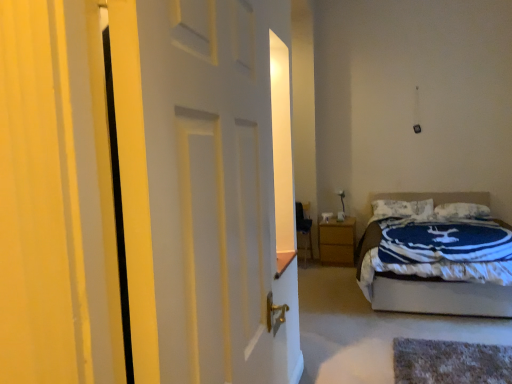
This screenshot has height=384, width=512. What are the coordinates of `white matte door at center` in the screenshot? It's located at (206, 189).

Would you consider white soft pillow at upper center, arranged as the 1th pillow when viewed from the right, to be distant from wooden nightstand at lower right?

Yes, white soft pillow at upper center, arranged as the 1th pillow when viewed from the right, and wooden nightstand at lower right are quite far apart.

Does white soft pillow at upper center, arranged as the 1th pillow when viewed from the right, come behind wooden nightstand at lower right?

No, it is not.

Is point (449, 205) closer or farther from the camera than point (334, 247)?

Point (449, 205) is positioned farther from the camera compared to point (334, 247).

Considering the sizes of objects white soft pillow at upper center, the second pillow in the left-to-right sequence, and wooden nightstand at lower right in the image provided, who is wider, white soft pillow at upper center, the second pillow in the left-to-right sequence, or wooden nightstand at lower right?

wooden nightstand at lower right is wider.

Which point is more forward, (390, 216) or (416, 303)?

Point (416, 303)

Is white textured pillow at upper center, which is counted as the first pillow, starting from the left, to the left of blue and white quilted bed at right from the viewer's perspective?

Yes, white textured pillow at upper center, which is counted as the first pillow, starting from the left, is to the left of blue and white quilted bed at right.

How different are the orientations of white textured pillow at upper center, which is counted as the first pillow, starting from the left, and blue and white quilted bed at right in degrees?

white textured pillow at upper center, which is counted as the first pillow, starting from the left, and blue and white quilted bed at right are facing 8.79e-05 degrees away from each other.

Is white textured pillow at upper center, which is counted as the first pillow, starting from the left, wider or thinner than blue and white quilted bed at right?

white textured pillow at upper center, which is counted as the first pillow, starting from the left, is thinner than blue and white quilted bed at right.

Does point (146, 142) come behind point (440, 210)?

No.

Is white matte door at center in front of or behind white soft pillow at upper center, arranged as the 1th pillow when viewed from the right, in the image?

Clearly, white matte door at center is in front of white soft pillow at upper center, arranged as the 1th pillow when viewed from the right.

Considering the relative sizes of white matte door at center and white soft pillow at upper center, arranged as the 1th pillow when viewed from the right, in the image provided, is white matte door at center thinner than white soft pillow at upper center, arranged as the 1th pillow when viewed from the right,?

Indeed, white matte door at center has a lesser width compared to white soft pillow at upper center, arranged as the 1th pillow when viewed from the right.

Based on their sizes in the image, would you say white matte door at center is bigger or smaller than white soft pillow at upper center, the second pillow in the left-to-right sequence?

Considering their sizes, white matte door at center takes up more space than white soft pillow at upper center, the second pillow in the left-to-right sequence.

Considering the positions of objects blue and white quilted bed at right and white matte door at center in the image provided, who is in front, blue and white quilted bed at right or white matte door at center?

white matte door at center is more forward.

Considering the positions of objects blue and white quilted bed at right and white matte door at center in the image provided, who is more to the right, blue and white quilted bed at right or white matte door at center?

blue and white quilted bed at right.

Is blue and white quilted bed at right turned away from white matte door at center?

That's not correct — blue and white quilted bed at right is not looking away from white matte door at center.

Is white matte door at center in contact with white textured pillow at upper center, arranged as the second pillow when viewed from the right?

No, white matte door at center is not with white textured pillow at upper center, arranged as the second pillow when viewed from the right.

From a real-world perspective, between white matte door at center and white textured pillow at upper center, which is counted as the first pillow, starting from the left, who is vertically higher?

white matte door at center.

From the image's perspective, relative to white textured pillow at upper center, arranged as the second pillow when viewed from the right, is white matte door at center above or below?

Clearly, from the image's perspective, white matte door at center is above white textured pillow at upper center, arranged as the second pillow when viewed from the right.

Which of these two, blue and white quilted bed at right or wooden nightstand at lower right, is smaller?

With smaller size is wooden nightstand at lower right.

Does blue and white quilted bed at right contain wooden nightstand at lower right?

No, wooden nightstand at lower right is located outside of blue and white quilted bed at right.

Which is closer to the camera, (434, 288) or (324, 259)?

Positioned in front is point (434, 288).

Between blue and white quilted bed at right and wooden nightstand at lower right, which one is positioned behind?

wooden nightstand at lower right is further away from the camera.

Based on the photo, is the depth of wooden nightstand at lower right less than that of blue and white quilted bed at right?

No.

From the image's perspective, is wooden nightstand at lower right located above blue and white quilted bed at right?

No, from the image's perspective, wooden nightstand at lower right is not over blue and white quilted bed at right.

From a real-world perspective, is wooden nightstand at lower right positioned above or below blue and white quilted bed at right?

From a real-world perspective, wooden nightstand at lower right is physically below blue and white quilted bed at right.

Is wooden nightstand at lower right directly adjacent to blue and white quilted bed at right?

No.

Locate an element on the screen. Image resolution: width=512 pixels, height=384 pixels. nightstand below the white soft pillow at upper center, arranged as the 1th pillow when viewed from the right (from a real-world perspective) is located at coordinates (337, 241).

Identify the location of pillow that is the 2nd one when counting backward from the blue and white quilted bed at right. The height and width of the screenshot is (384, 512). (402, 208).

From the image, which object appears to be farther from blue and white quilted bed at right, white textured pillow at upper center, which is counted as the first pillow, starting from the left, or wooden nightstand at lower right?

Among the two, white textured pillow at upper center, which is counted as the first pillow, starting from the left, is located further to blue and white quilted bed at right.

Based on their spatial positions, is wooden nightstand at lower right or white textured pillow at upper center, which is counted as the first pillow, starting from the left, further from white matte door at center?

The object further to white matte door at center is white textured pillow at upper center, which is counted as the first pillow, starting from the left.

Estimate the real-world distances between objects in this image. Which object is closer to white matte door at center, blue and white quilted bed at right or wooden nightstand at lower right?

blue and white quilted bed at right is closer to white matte door at center.

Which object lies nearer to the anchor point wooden nightstand at lower right, white soft pillow at upper center, the second pillow in the left-to-right sequence, or white matte door at center?

The object closer to wooden nightstand at lower right is white soft pillow at upper center, the second pillow in the left-to-right sequence.

Which object lies further to the anchor point white soft pillow at upper center, the second pillow in the left-to-right sequence, white matte door at center or white textured pillow at upper center, arranged as the second pillow when viewed from the right?

white matte door at center lies further to white soft pillow at upper center, the second pillow in the left-to-right sequence, than the other object.

Based on their spatial positions, is wooden nightstand at lower right or white textured pillow at upper center, arranged as the second pillow when viewed from the right, further from blue and white quilted bed at right?

Among the two, white textured pillow at upper center, arranged as the second pillow when viewed from the right, is located further to blue and white quilted bed at right.

Consider the image. Looking at the image, which one is located further to white textured pillow at upper center, which is counted as the first pillow, starting from the left, white soft pillow at upper center, the second pillow in the left-to-right sequence, or wooden nightstand at lower right?

wooden nightstand at lower right is further to white textured pillow at upper center, which is counted as the first pillow, starting from the left.

Looking at the image, which one is located further to white soft pillow at upper center, arranged as the 1th pillow when viewed from the right, blue and white quilted bed at right or wooden nightstand at lower right?

The object further to white soft pillow at upper center, arranged as the 1th pillow when viewed from the right, is blue and white quilted bed at right.

This screenshot has height=384, width=512. Identify the location of pillow between blue and white quilted bed at right and white textured pillow at upper center, which is counted as the first pillow, starting from the left, along the z-axis. click(462, 210).

Where is `bed between white matte door at center and wooden nightstand at lower right in the front-back direction`? bed between white matte door at center and wooden nightstand at lower right in the front-back direction is located at coordinates (442, 298).

You are a GUI agent. You are given a task and a screenshot of the screen. Output one action in this format:
    pyautogui.click(x=<x>, y=<y>)
    Task: Click on the bed between white matte door at center and white textured pillow at upper center, which is counted as the first pillow, starting from the left, from front to back
    
    Given the screenshot: What is the action you would take?
    pyautogui.click(x=442, y=298)

Identify the location of pillow between wooden nightstand at lower right and white soft pillow at upper center, arranged as the 1th pillow when viewed from the right. (402, 208).